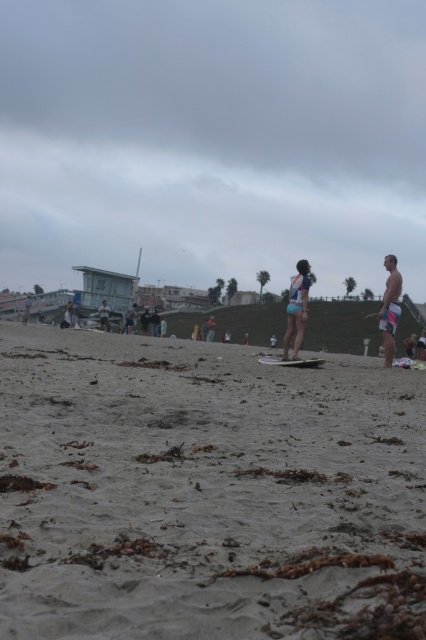
Question: Does matte blue swimsuit at center have a lesser width compared to light blue denim shorts at center?

Choices:
 (A) no
 (B) yes

Answer: (B)

Question: Which point is closer to the camera taking this photo?

Choices:
 (A) (385, 362)
 (B) (106, 324)

Answer: (A)

Question: Does gray sandy beach at center have a larger size compared to white surfboard at right?

Choices:
 (A) yes
 (B) no

Answer: (A)

Question: Can you confirm if gray sandy beach at center is positioned to the right of white surfboard at right?

Choices:
 (A) no
 (B) yes

Answer: (A)

Question: Which of the following is the farthest from the observer?

Choices:
 (A) (301, 328)
 (B) (389, 339)
 (C) (60, 356)
 (D) (97, 314)

Answer: (D)

Question: Which of the following is the closest to the observer?

Choices:
 (A) smooth tan surfboard at center
 (B) matte blue swimsuit at center
 (C) light blue denim shorts at center

Answer: (B)